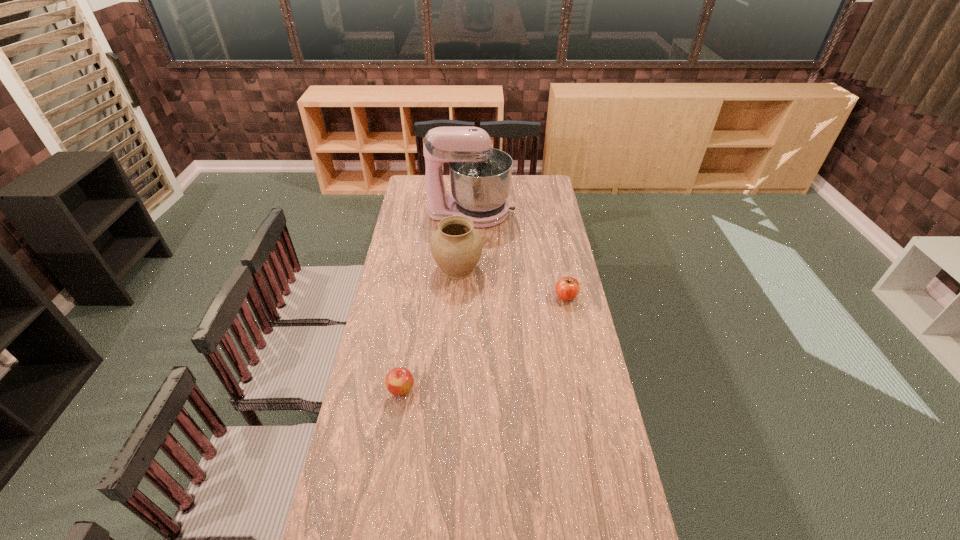
Identify the location of free space located 0.340m on the left of the rightmost object. The image size is (960, 540). (476, 296).

You are a GUI agent. You are given a task and a screenshot of the screen. Output one action in this format:
    pyautogui.click(x=<x>, y=<y>)
    Task: Click on the free space located 0.090m on the front of the nearer apple
    Image resolution: width=960 pixels, height=540 pixels.
    Given the screenshot: What is the action you would take?
    pyautogui.click(x=396, y=425)

Locate an element on the screen. This screenshot has height=540, width=960. object that is positioned at the far edge is located at coordinates (480, 176).

The image size is (960, 540). In order to click on mixer that is at the left edge in this screenshot , I will do `click(480, 176)`.

Find the location of a particular element. apple at the left edge is located at coordinates [x=399, y=381].

Find the location of a particular element. The width and height of the screenshot is (960, 540). object that is at the right edge is located at coordinates (567, 288).

Where is `object positioned at the far left corner`? This screenshot has height=540, width=960. object positioned at the far left corner is located at coordinates tap(480, 176).

You are a GUI agent. You are given a task and a screenshot of the screen. Output one action in this format:
    pyautogui.click(x=<x>, y=<y>)
    Task: Click on the free space at the far edge
    
    Given the screenshot: What is the action you would take?
    pyautogui.click(x=521, y=190)

In the image, there is a desktop. Where is `free space at the left edge`? This screenshot has height=540, width=960. free space at the left edge is located at coordinates (376, 440).

You are a GUI agent. You are given a task and a screenshot of the screen. Output one action in this format:
    pyautogui.click(x=<x>, y=<y>)
    Task: Click on the free space at the right edge of the desktop
    The image size is (960, 540).
    Given the screenshot: What is the action you would take?
    pyautogui.click(x=594, y=508)